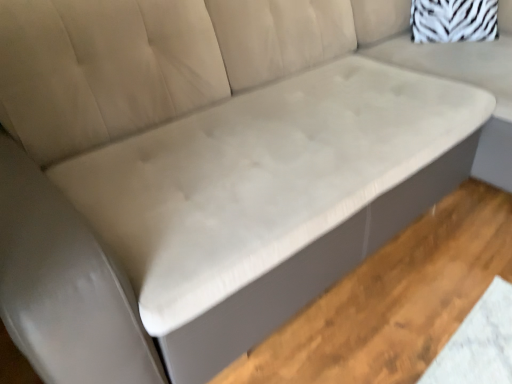
Where is `white zebra-patterned pillow at upper right`? The width and height of the screenshot is (512, 384). white zebra-patterned pillow at upper right is located at coordinates (453, 20).

Image resolution: width=512 pixels, height=384 pixels. What do you see at coordinates (453, 20) in the screenshot? I see `white zebra-patterned pillow at upper right` at bounding box center [453, 20].

Image resolution: width=512 pixels, height=384 pixels. Find the location of `white zebra-patterned pillow at upper right`. white zebra-patterned pillow at upper right is located at coordinates (453, 20).